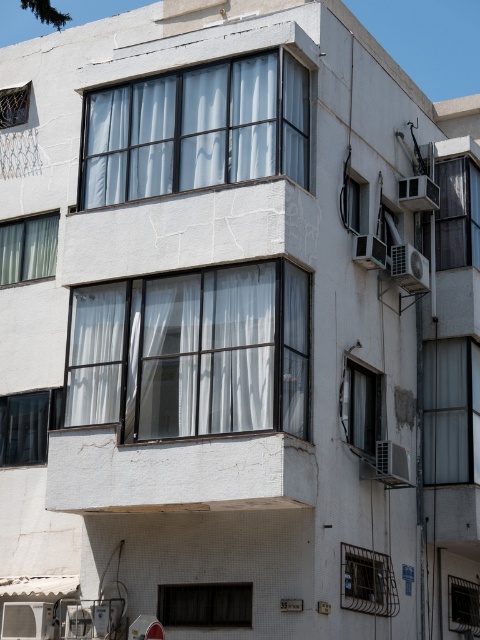
Question: In this image, where is metallic gray window at right located relative to clear glass window at center?

Choices:
 (A) above
 (B) below

Answer: (A)

Question: Which object is the farthest from the black glass window at lower left?

Choices:
 (A) clear glass window at upper right
 (B) white matte window at center-right
 (C) clear glass window at center

Answer: (C)

Question: Can you confirm if black matte window at lower center is positioned below clear glass window at center?

Choices:
 (A) no
 (B) yes

Answer: (A)

Question: Which point is farther from the camera taking this photo?

Choices:
 (A) (130, 285)
 (B) (362, 371)

Answer: (B)

Question: Among these points, which one is farthest from the camera?

Choices:
 (A) (356, 433)
 (B) (286, 112)

Answer: (A)

Question: Does metallic gray window at right have a greater width compared to metallic mesh window at upper left?

Choices:
 (A) no
 (B) yes

Answer: (B)